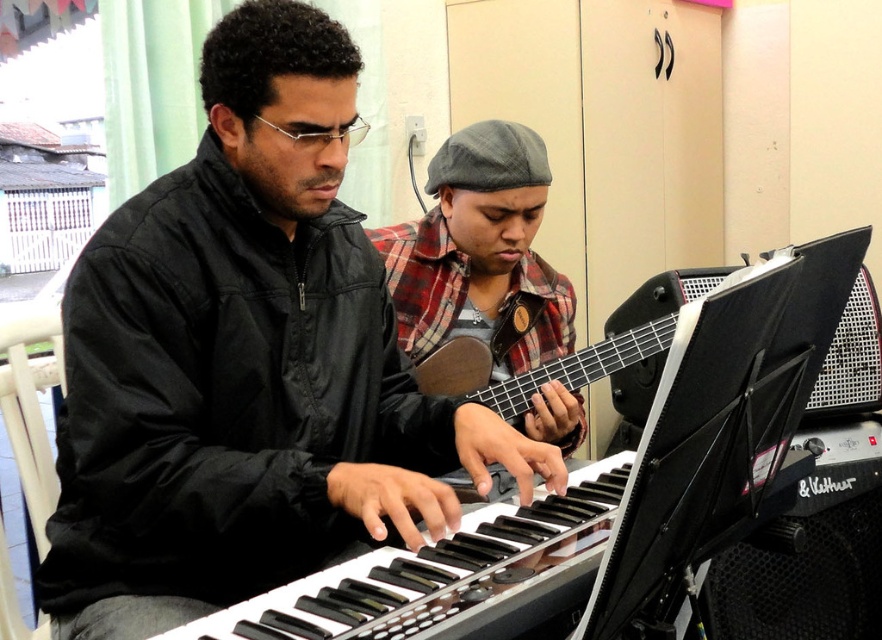
Question: Among these points, which one is farthest from the camera?

Choices:
 (A) (430, 330)
 (B) (320, 602)
 (C) (615, 358)

Answer: (A)

Question: Can you confirm if black matte jacket at center is wider than black glossy keyboard at center?

Choices:
 (A) yes
 (B) no

Answer: (A)

Question: Which of these objects is positioned farthest from the black glossy keyboard at center?

Choices:
 (A) plaid fabric guitar at center
 (B) black matte jacket at center
 (C) wooden acoustic guitar at center

Answer: (A)

Question: Among these points, which one is nearest to the camera?

Choices:
 (A) (468, 161)
 (B) (628, 301)
 (C) (367, 280)

Answer: (C)

Question: Observing the image, what is the correct spatial positioning of black matte jacket at center in reference to wooden acoustic guitar at center?

Choices:
 (A) left
 (B) right

Answer: (A)

Question: Does black matte jacket at center appear over plaid fabric guitar at center?

Choices:
 (A) no
 (B) yes

Answer: (A)